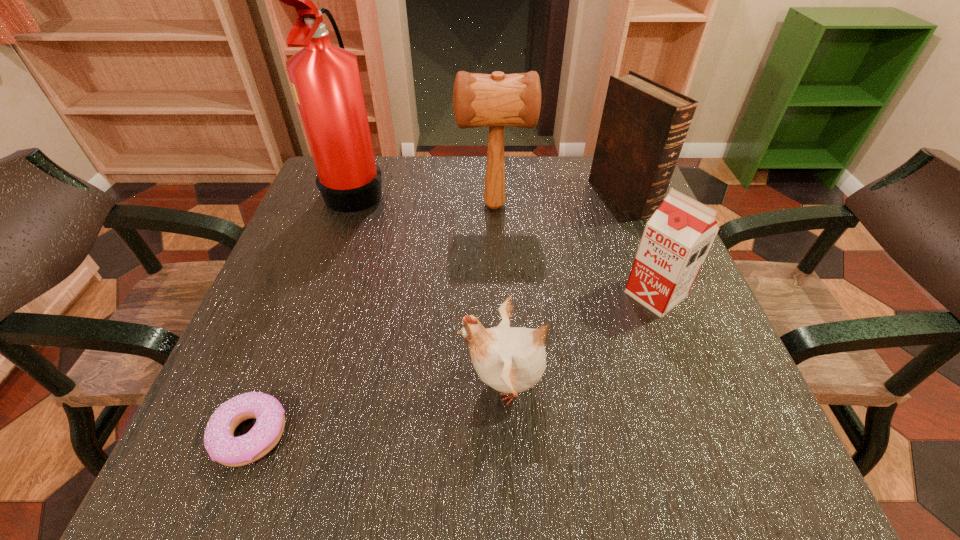
The width and height of the screenshot is (960, 540). Find the location of `vacant space that's between the mallet and the fourth farthest object`. vacant space that's between the mallet and the fourth farthest object is located at coordinates (575, 250).

You are a GUI agent. You are given a task and a screenshot of the screen. Output one action in this format:
    pyautogui.click(x=<x>, y=<y>)
    Task: Click on the vacant area between the doughnut and the tallest object
    The width and height of the screenshot is (960, 540).
    Given the screenshot: What is the action you would take?
    pyautogui.click(x=302, y=312)

The image size is (960, 540). I want to click on vacant space that's between the fire extinguisher and the bird, so click(x=430, y=286).

This screenshot has width=960, height=540. I want to click on vacant area that lies between the doughnut and the fire extinguisher, so click(x=302, y=312).

Point out which object is positioned as the nearest to the bird. Please provide its 2D coordinates. Your answer should be formatted as a tuple, i.e. [(x, y)], where the tuple contains the x and y coordinates of a point satisfying the conditions above.

[(677, 238)]

Point out which object is positioned as the fourth nearest to the shortest object. Please provide its 2D coordinates. Your answer should be formatted as a tuple, i.e. [(x, y)], where the tuple contains the x and y coordinates of a point satisfying the conditions above.

[(677, 238)]

Image resolution: width=960 pixels, height=540 pixels. In order to click on free space that satisfies the following two spatial constraints: 1. at the spray nozzle of the fire extinguisher; 2. on the back side of the fourth shortest object in this screenshot , I will do `click(353, 197)`.

Find the location of a particular element. Image resolution: width=960 pixels, height=540 pixels. blank area in the image that satisfies the following two spatial constraints: 1. at the spray nozzle of the tallest object; 2. on the back side of the fourth shortest object is located at coordinates (353, 197).

This screenshot has height=540, width=960. In order to click on free spot that satisfies the following two spatial constraints: 1. at the spray nozzle of the fourth farthest object; 2. on the left side of the fire extinguisher in this screenshot , I will do `click(319, 294)`.

The image size is (960, 540). Identify the location of free region that satisfies the following two spatial constraints: 1. at the spray nozzle of the tallest object; 2. on the back side of the fourth tallest object. click(x=319, y=294).